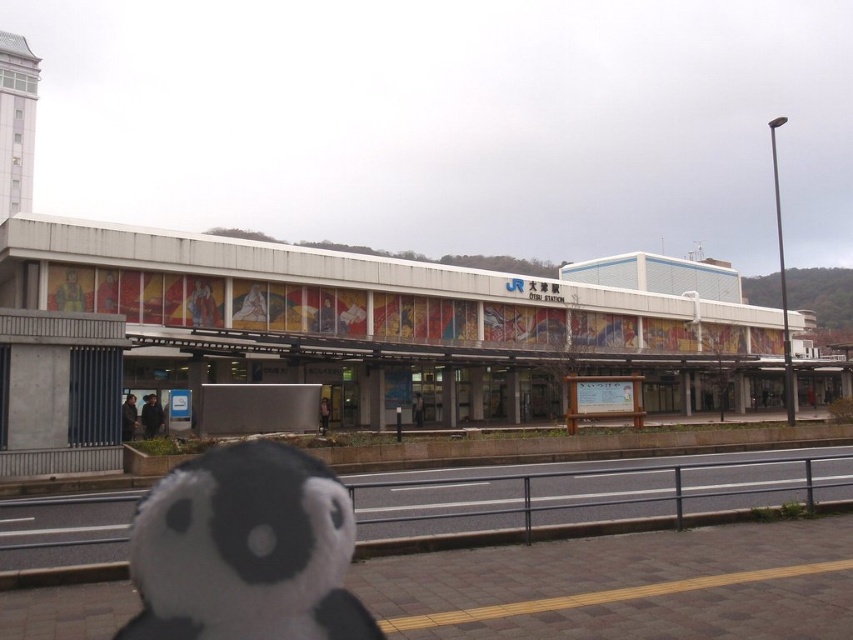
You are standing at a modern train station with a panda toy in front of you. The panda is at point (252, 605). If you want to take a photo of the station sign with the panda in the frame, will the panda be in your line of sight? Please explain using the distance between the panda and you.

The panda at point (252, 605) is 5.46 meters away from you. Since the panda is in the foreground between you and the station sign, it will be in your line of sight when taking a photo of the sign.

You are a visitor at the train station and see the white plush at lower left and the black rubber train track at lower left. Which object is smaller in size?

The white plush at lower left is smaller than the black rubber train track at lower left.

You are standing at the entrance of the JR station and see the white plush at lower left. If you want to pick it up without moving your feet, can you reach it?

The white plush at lower left is 16.04 feet from viewer. Since 16.04 feet is approximately 4.9 meters, which is quite far, you cannot reach it without moving your feet.